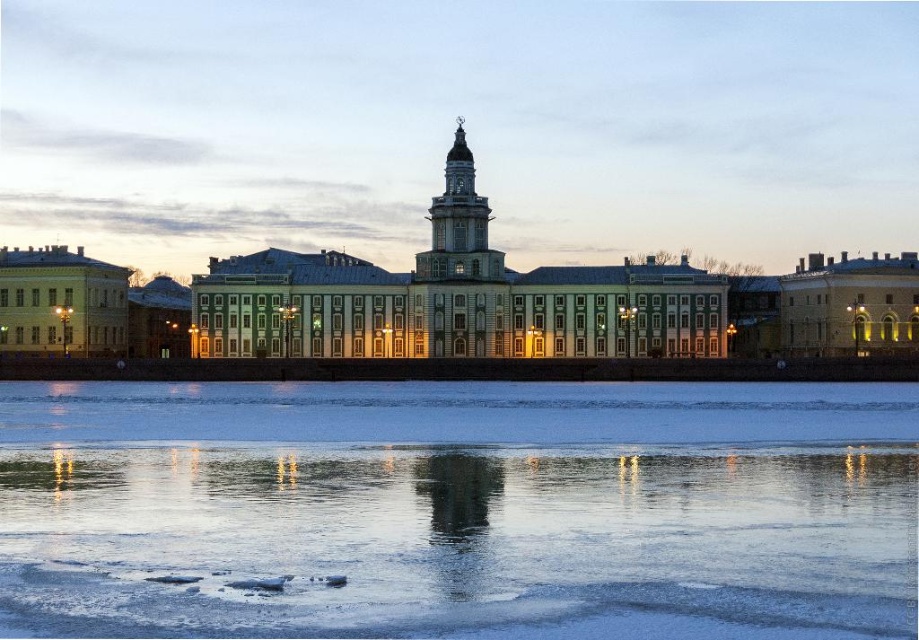
Question: In this image, where is white stone building at center located relative to light gray stone tower at center?

Choices:
 (A) right
 (B) left

Answer: (B)

Question: Considering the relative positions of white stone building at center and light gray stone tower at center in the image provided, where is white stone building at center located with respect to light gray stone tower at center?

Choices:
 (A) right
 (B) left

Answer: (B)

Question: Among these objects, which one is farthest from the camera?

Choices:
 (A) white stone building at center
 (B) light gray stone tower at center

Answer: (B)

Question: Is translucent ice at lower center to the left of white stone building at center from the viewer's perspective?

Choices:
 (A) yes
 (B) no

Answer: (B)

Question: Which of the following is the farthest from the observer?

Choices:
 (A) (460, 163)
 (B) (657, 298)
 (C) (309, 424)

Answer: (B)

Question: Which of the following is the farthest from the observer?

Choices:
 (A) white stone building at center
 (B) translucent ice at lower center
 (C) light gray stone tower at center

Answer: (C)